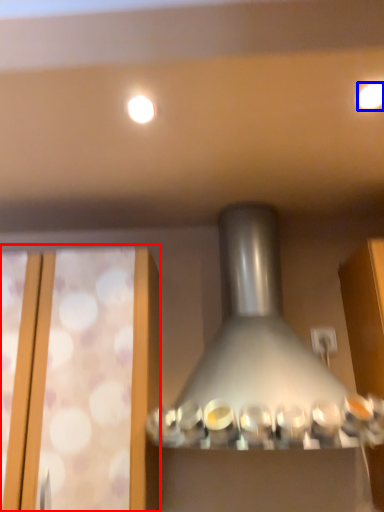
Question: Which of the following is the closest to the observer, glass door (highlighted by a red box) or lighting (highlighted by a blue box)?

Choices:
 (A) glass door
 (B) lighting

Answer: (B)